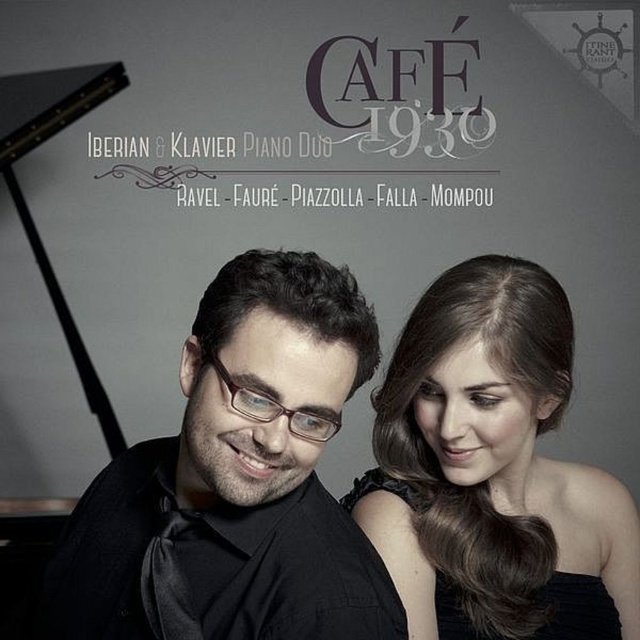
Question: Is black matte shirt at center positioned in front of brown hair at upper right?

Choices:
 (A) no
 (B) yes

Answer: (B)

Question: Which of the following is the closest to the observer?

Choices:
 (A) black satin dress at center
 (B) brown hair at upper right
 (C) black matte shirt at center

Answer: (C)

Question: Does black matte shirt at center have a lesser width compared to black satin dress at center?

Choices:
 (A) yes
 (B) no

Answer: (B)

Question: Which point is closer to the camera taking this photo?

Choices:
 (A) (570, 586)
 (B) (221, 557)

Answer: (B)

Question: Estimate the real-world distances between objects in this image. Which object is closer to the black satin dress at center?

Choices:
 (A) brown hair at upper right
 (B) black matte shirt at center

Answer: (A)

Question: Is brown hair at upper right further to the viewer compared to black satin dress at center?

Choices:
 (A) no
 (B) yes

Answer: (A)